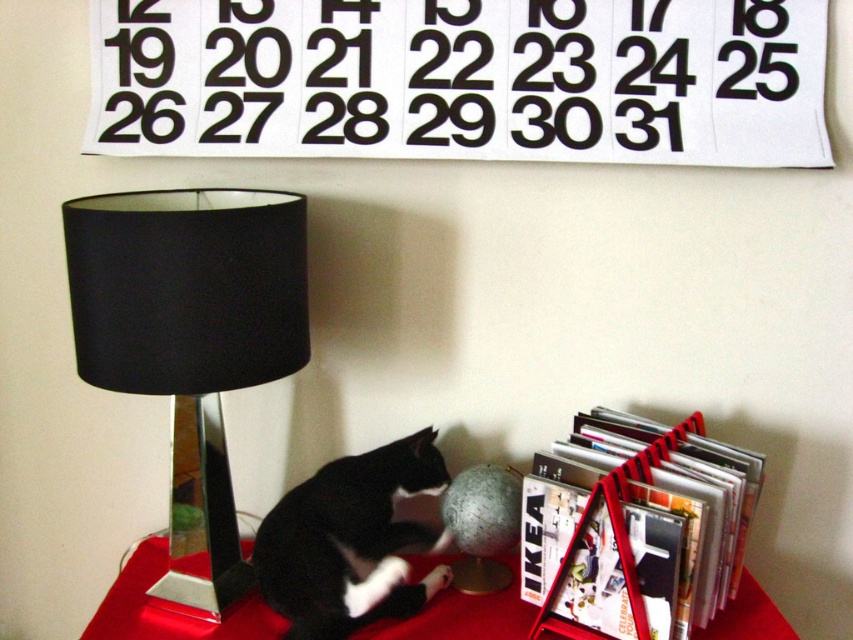
You are standing in the room and want to reach the black fabric lamp at left without moving your feet. Can you stretch your arm out to touch it?

The black fabric lamp at left is 36.84 inches away from the viewer. Since the average human arm span is about 36 inches, you might just barely reach it with your fingertips if you stretch out your arm fully.

You are arranging a small plant on a table and need to ensure it fits between the black fabric lamp at left and the smooth red table at center. Given that the plant requires 30 cm of space, can the space between them accommodate it?

The black fabric lamp at left is larger in size than the smooth red table at center, but the exact distance between them isn